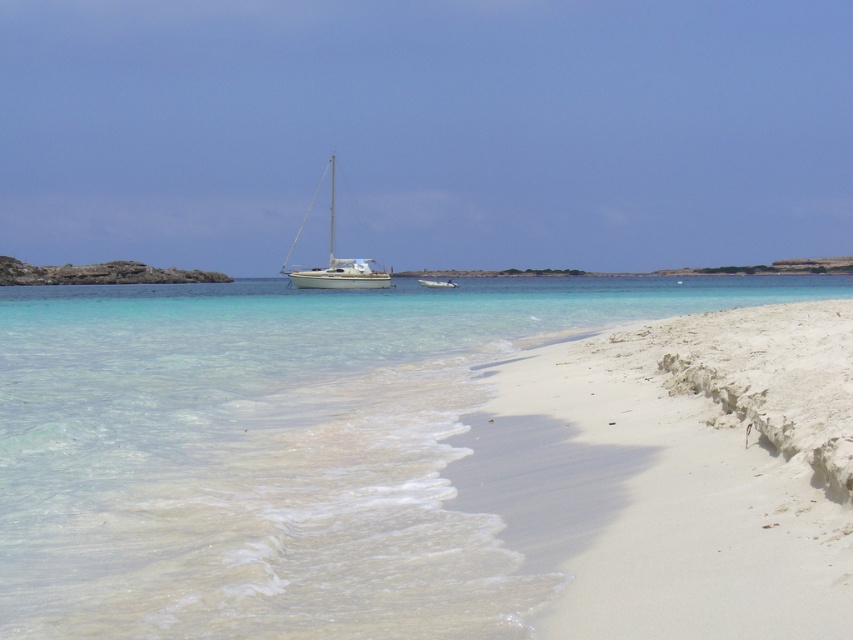
Who is more distant from viewer, (405, 344) or (822, 518)?

The point (405, 344) is more distant.

Consider the image. Is clear water at center positioned at the back of white sandy beach at lower right?

Yes, it is.

Where is `clear water at center`? Image resolution: width=853 pixels, height=640 pixels. clear water at center is located at coordinates (276, 451).

Where is `clear water at center`? This screenshot has width=853, height=640. clear water at center is located at coordinates (x=276, y=451).

Is clear water at center positioned behind white glossy sailboat at center?

That is False.

Is point (498, 316) in front of point (370, 280)?

Yes, it is.

Locate an element on the screen. clear water at center is located at coordinates 276,451.

Which is above, white sandy beach at lower right or white glossy sailboat at center?

white glossy sailboat at center

Find the location of `white sandy beach at lower right`. white sandy beach at lower right is located at coordinates (677, 474).

At what (x,y) coordinates should I click in order to perform the action: click on white sandy beach at lower right. Please return your answer as a coordinate pair (x, y). The image size is (853, 640). Looking at the image, I should click on (677, 474).